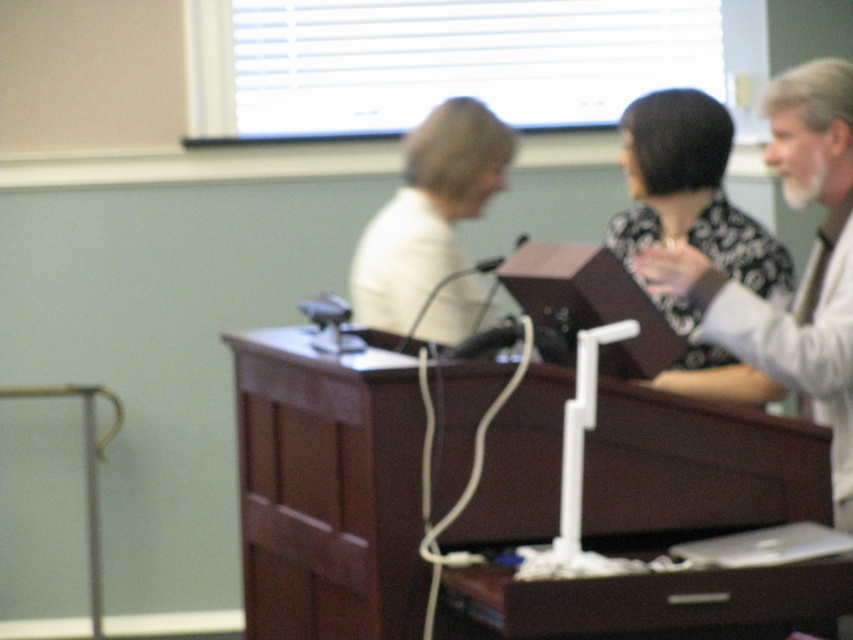
Is the position of white textured shirt at upper right less distant than that of black dotted dress at center?

Answer: Yes, white textured shirt at upper right is closer to the viewer.

Who is lower down, white textured shirt at upper right or black dotted dress at center?

white textured shirt at upper right is lower down.

Is point (820, 128) less distant than point (671, 372)?

Yes, it is in front of point (671, 372).

Where is `white textured shirt at upper right`? white textured shirt at upper right is located at coordinates (805, 268).

Is point (677, 173) positioned after point (451, 177)?

No.

Is point (779, 280) positioned after point (434, 138)?

That is False.

Find the location of a particular element. This screenshot has height=640, width=853. black dotted dress at center is located at coordinates (691, 189).

Between point (483, 634) and point (399, 193), which one is positioned behind?

The point (399, 193) is more distant.

Can you confirm if dark wood table at center is wider than white matte shirt at center?

Yes.

What are the coordinates of `dark wood table at center` in the screenshot? It's located at (328, 490).

What are the coordinates of `dark wood table at center` in the screenshot? It's located at (328, 490).